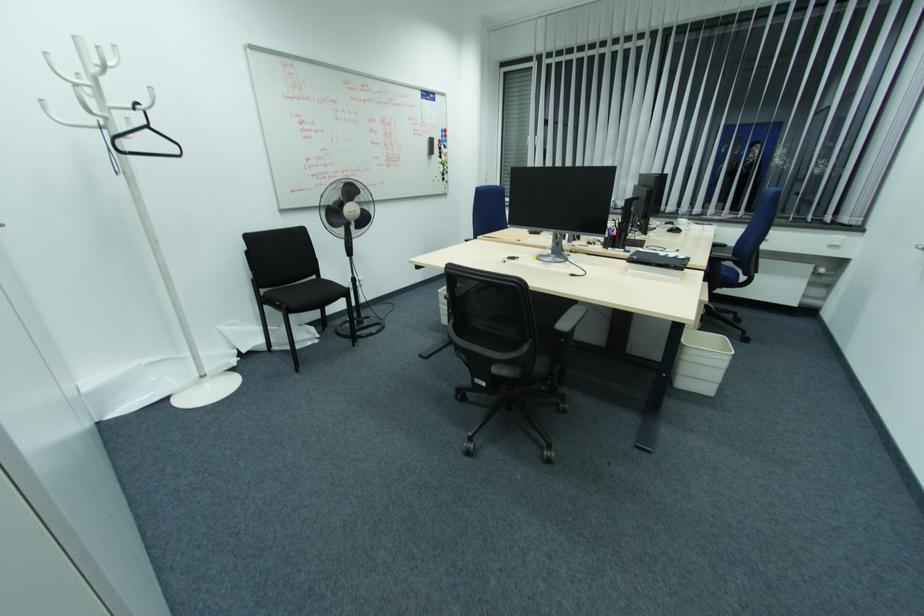
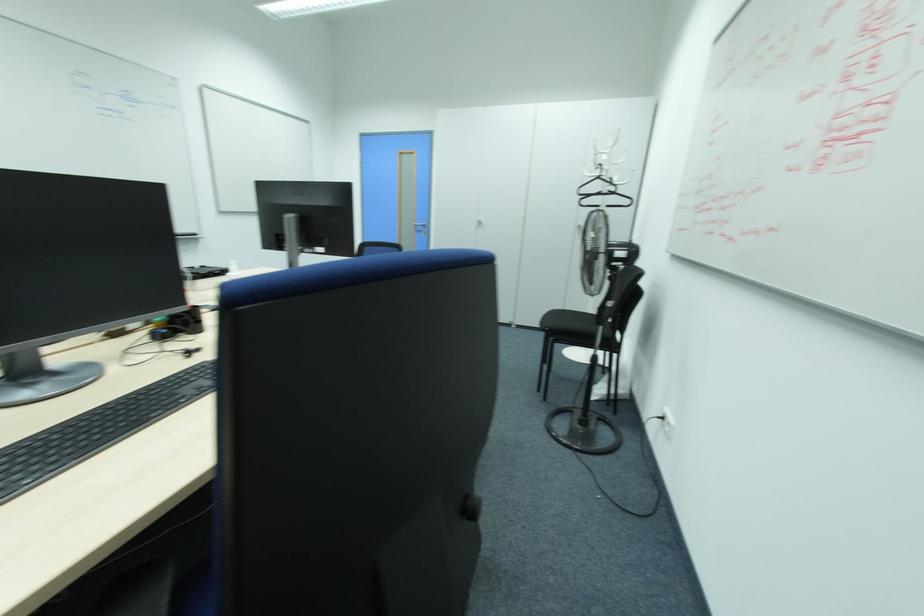
In the second image, find the point that corresponds to (149,128) in the first image.

(599, 177)